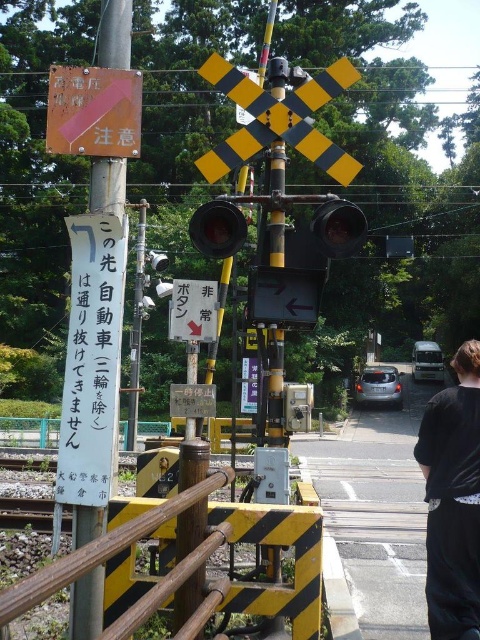
This screenshot has height=640, width=480. What do you see at coordinates (273, 547) in the screenshot? I see `yellow/black striped rail at lower center` at bounding box center [273, 547].

Based on the photo, between yellow/black striped rail at lower center and metallic signpost at left, which one has less height?

With less height is metallic signpost at left.

Does point (308, 529) come farther from viewer compared to point (94, 168)?

No.

Where is `yellow/black striped rail at lower center`? This screenshot has width=480, height=640. yellow/black striped rail at lower center is located at coordinates (273, 547).

At what (x,y) coordinates should I click in order to perform the action: click on black fabric bag at lower right. Please return your answer as a coordinate pair (x, y). Image resolution: width=480 pixels, height=640 pixels. Looking at the image, I should click on (453, 500).

Does black fabric bag at lower right lie behind black plastic arrow at center?

No, black fabric bag at lower right is in front of black plastic arrow at center.

Between point (477, 387) and point (320, 300), which one is positioned behind?

Point (320, 300)

I want to click on black fabric bag at lower right, so click(x=453, y=500).

You are a GUI agent. You are given a task and a screenshot of the screen. Output one action in this format:
    pyautogui.click(x=<x>, y=<y>)
    Task: Click on the black fabric bag at lower right
    The image size is (480, 640).
    Given the screenshot: What is the action you would take?
    pyautogui.click(x=453, y=500)